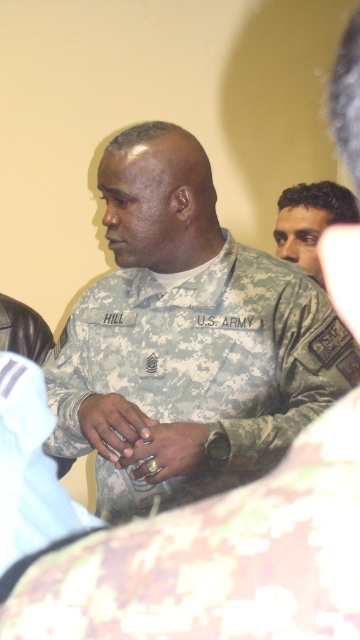
What do you see at coordinates (165, 451) in the screenshot? This screenshot has height=640, width=360. I see `gold metallic ring at center` at bounding box center [165, 451].

Is point (159, 467) closer to viewer compared to point (91, 417)?

Yes, point (159, 467) is in front of point (91, 417).

Image resolution: width=360 pixels, height=640 pixels. What are the coordinates of `gold metallic ring at center` in the screenshot? It's located at (165, 451).

Which is below, camouflage fabric us army uniform at center or matte camouflage ring at center?

matte camouflage ring at center is below.

From the picture: Is camouflage fabric us army uniform at center below matte camouflage ring at center?

No.

The image size is (360, 640). Find the location of `camouflage fabric us army uniform at center`. camouflage fabric us army uniform at center is located at coordinates (200, 369).

Can you confirm if dark brown hair at upper right is positioned to the left of gold metallic ring at center?

Incorrect, dark brown hair at upper right is not on the left side of gold metallic ring at center.

Which is in front, point (308, 208) or point (189, 451)?

Positioned in front is point (189, 451).

Find the location of a particular element. This screenshot has width=360, height=640. dark brown hair at upper right is located at coordinates (311, 220).